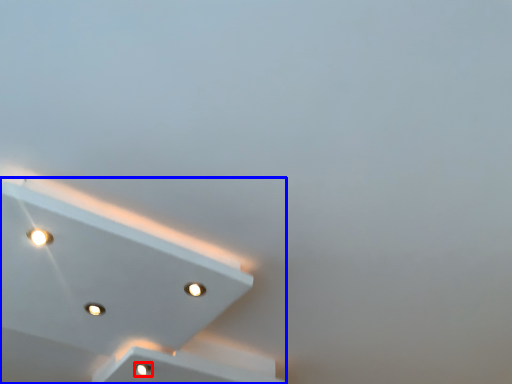
Question: Which of the following is the farthest to the observer, dot (highlighted by a red box) or lamp (highlighted by a blue box)?

Choices:
 (A) dot
 (B) lamp

Answer: (A)